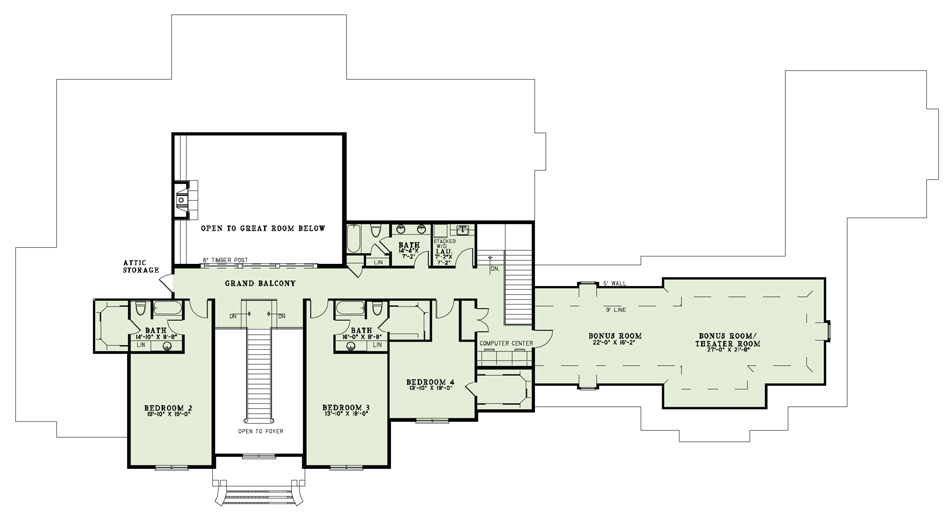
Where is `bathtub`? bathtub is located at coordinates (164, 304), (352, 307), (353, 233).